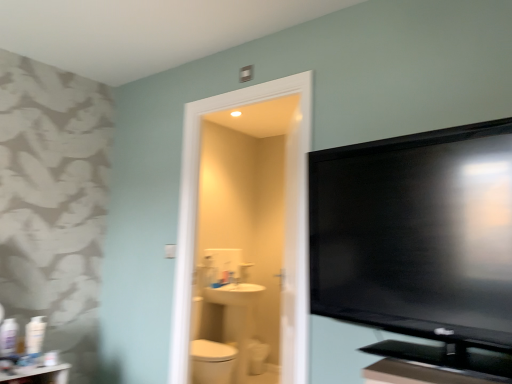
Question: From their relative heights in the image, would you say black glossy flat-screen tv at right is taller or shorter than white glossy toilet bowl at center?

Choices:
 (A) tall
 (B) short

Answer: (A)

Question: From the image's perspective, is black glossy flat-screen tv at right located above or below white glossy toilet bowl at center?

Choices:
 (A) above
 (B) below

Answer: (A)

Question: Which object is positioned closest to the white plastic bottles at left, which appears as the 1th toiletry when viewed from the left?

Choices:
 (A) white glossy sink at center
 (B) white glossy toilet bowl at center
 (C) white glossy table at lower left
 (D) white plastic bottle at left, the 1th toiletry from the right
 (E) black glossy flat-screen tv at right

Answer: (D)

Question: Considering the real-world distances, which object is closest to the white glossy toilet bowl at center?

Choices:
 (A) white glossy table at lower left
 (B) white glossy sink at center
 (C) white plastic bottles at left, arranged as the second toiletry when viewed from the right
 (D) white plastic bottle at left, the 2th toiletry in the left-to-right sequence
 (E) black glossy flat-screen tv at right

Answer: (B)